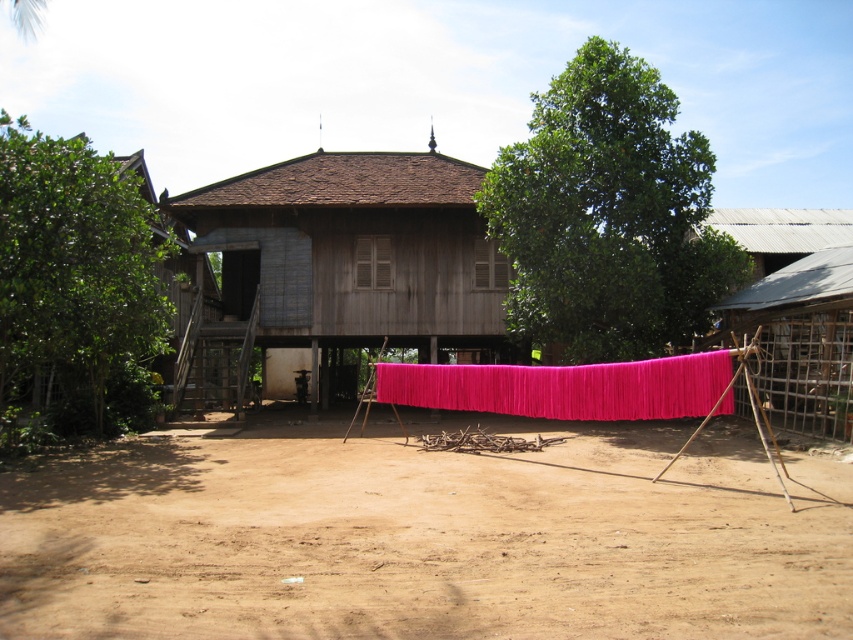
Question: Is pink fabric at right further to the viewer compared to pink fabric at center?

Choices:
 (A) yes
 (B) no

Answer: (A)

Question: Considering the real-world distances, which object is farthest from the wooden hut at center?

Choices:
 (A) pink fabric at center
 (B) brown dirt field at center

Answer: (A)

Question: Is the position of wooden hut at center more distant than that of pink fabric at center?

Choices:
 (A) yes
 (B) no

Answer: (A)

Question: Does brown dirt field at center appear over pink fabric at center?

Choices:
 (A) yes
 (B) no

Answer: (B)

Question: Which object is farther from the camera taking this photo?

Choices:
 (A) brown dirt field at center
 (B) pink fabric at right

Answer: (B)

Question: Considering the real-world distances, which object is farthest from the pink fabric at center?

Choices:
 (A) brown dirt field at center
 (B) wooden hut at center

Answer: (B)